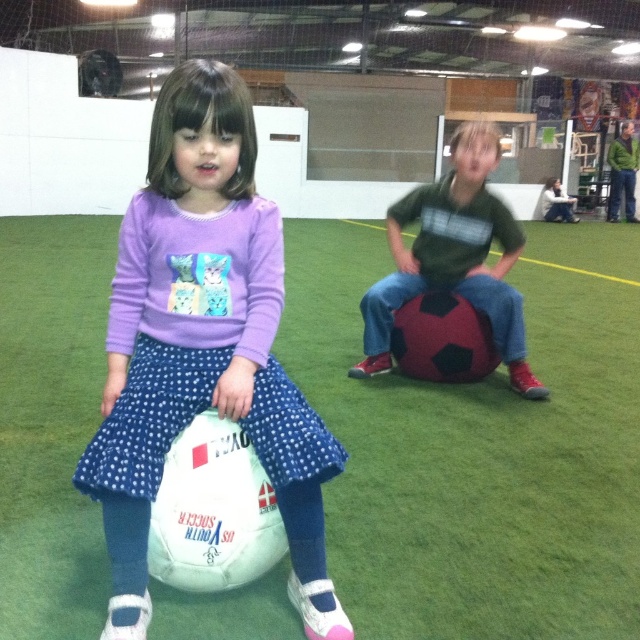
Question: Which point is farther to the camera?

Choices:
 (A) (195, 273)
 (B) (458, 285)

Answer: (B)

Question: Does white matte soccer ball at center lie behind dark green jersey at center?

Choices:
 (A) yes
 (B) no

Answer: (B)

Question: Which is nearer to the green artificial turf at center?

Choices:
 (A) dark green jersey at center
 (B) white matte soccer ball at center

Answer: (B)

Question: Is white matte soccer ball at center to the right of dark green jersey at center from the viewer's perspective?

Choices:
 (A) yes
 (B) no

Answer: (B)

Question: Which point is closer to the camera?

Choices:
 (A) (577, 516)
 (B) (536, 396)
 (C) (252, 156)

Answer: (C)

Question: In this image, where is green artificial turf at center located relative to white matte soccer ball at center?

Choices:
 (A) below
 (B) above

Answer: (A)